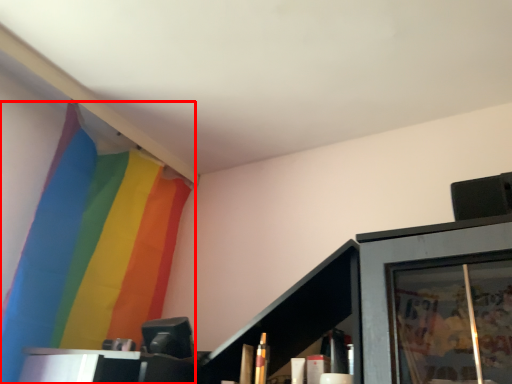
Question: From the image, what is the correct spatial relationship of curtain (annotated by the red box) in relation to cabinet?

Choices:
 (A) left
 (B) right

Answer: (A)